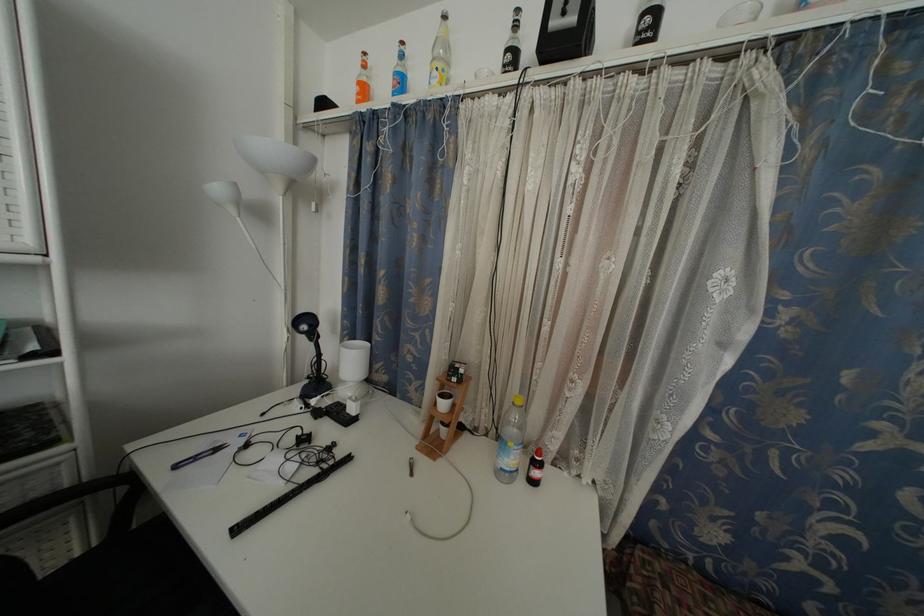
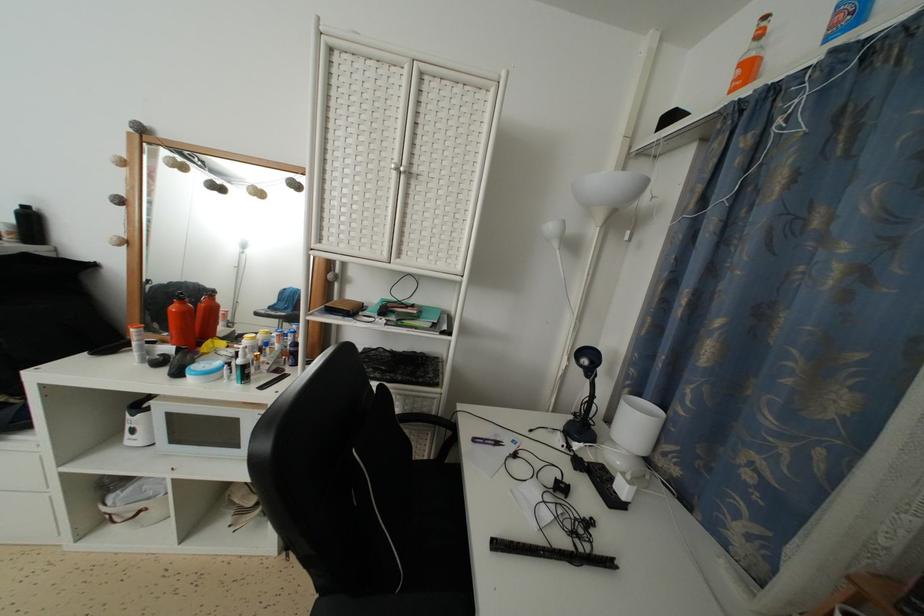
In the second image, find the point that corresponds to pixel 351 464 in the first image.

(614, 569)